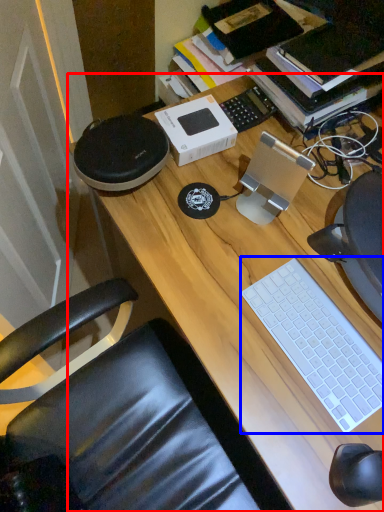
Question: Which point is closer to the camera, desk (highlighted by a red box) or computer keyboard (highlighted by a blue box)?

Choices:
 (A) desk
 (B) computer keyboard

Answer: (A)